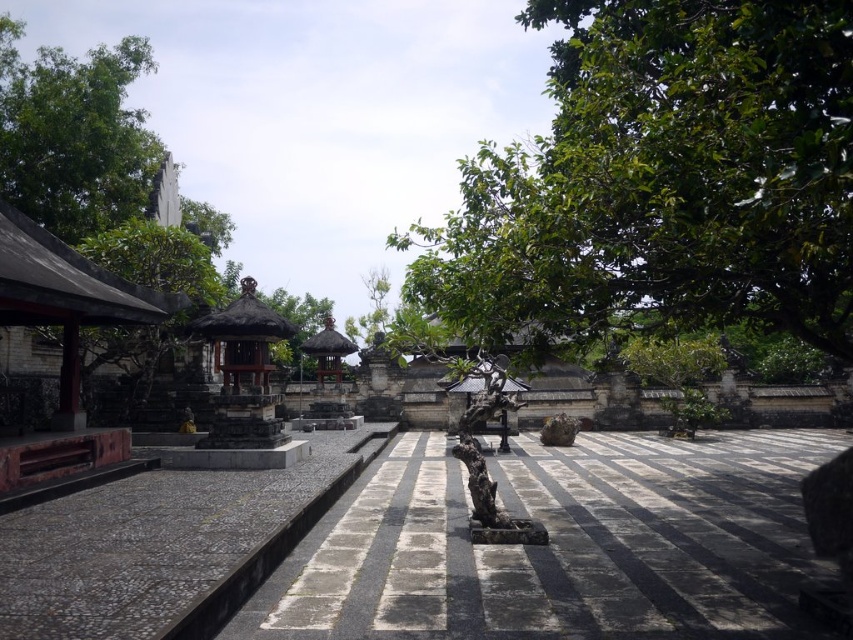
Can you confirm if green leafy tree at upper left is bigger than dark brown stone tree trunk at center?

Correct, green leafy tree at upper left is larger in size than dark brown stone tree trunk at center.

Can you confirm if green leafy tree at upper left is positioned to the right of dark brown stone tree trunk at center?

In fact, green leafy tree at upper left is to the left of dark brown stone tree trunk at center.

This screenshot has height=640, width=853. What are the coordinates of `green leafy tree at upper left` in the screenshot? It's located at (74, 134).

Is gray stone path at center to the left of thatched roof gazebo at center from the viewer's perspective?

In fact, gray stone path at center is to the right of thatched roof gazebo at center.

Is gray stone path at center shorter than thatched roof gazebo at center?

Correct, gray stone path at center is not as tall as thatched roof gazebo at center.

Is point (492, 595) closer to camera compared to point (339, 364)?

Yes.

This screenshot has height=640, width=853. What are the coordinates of `gray stone path at center` in the screenshot? It's located at (560, 545).

Based on the photo, who is more forward, (526, 186) or (503, 522)?

Point (526, 186) is more forward.

Can you confirm if green leafy tree at upper right is positioned above dark brown stone tree trunk at center?

Indeed, green leafy tree at upper right is positioned over dark brown stone tree trunk at center.

The width and height of the screenshot is (853, 640). Identify the location of green leafy tree at upper right. (660, 182).

This screenshot has width=853, height=640. In order to click on green leafy tree at upper right in this screenshot , I will do `click(660, 182)`.